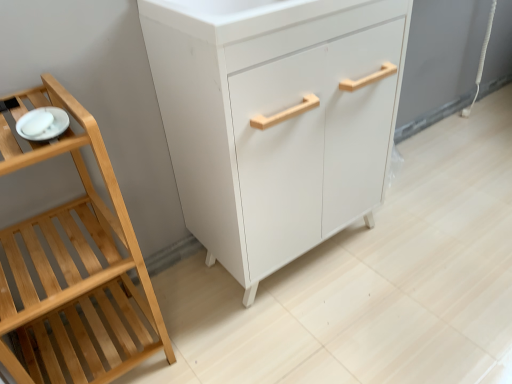
Question: Can you confirm if white glossy plate at left is shorter than natural wood shelf at left?

Choices:
 (A) no
 (B) yes

Answer: (B)

Question: Are white glossy plate at left and natural wood shelf at left far apart?

Choices:
 (A) no
 (B) yes

Answer: (A)

Question: Is white glossy plate at left positioned behind natural wood shelf at left?

Choices:
 (A) yes
 (B) no

Answer: (A)

Question: Can you confirm if white glossy plate at left is thinner than natural wood shelf at left?

Choices:
 (A) yes
 (B) no

Answer: (A)

Question: Can you confirm if white glossy plate at left is wider than natural wood shelf at left?

Choices:
 (A) yes
 (B) no

Answer: (B)

Question: Does point pos(289,200) appear closer or farther from the camera than point pos(101,248)?

Choices:
 (A) farther
 (B) closer

Answer: (A)

Question: Considering the positions of white matte cabinet at center and natural wood shelf at left in the image, is white matte cabinet at center wider or thinner than natural wood shelf at left?

Choices:
 (A) wide
 (B) thin

Answer: (A)

Question: From the image's perspective, relative to natural wood shelf at left, is white matte cabinet at center above or below?

Choices:
 (A) below
 (B) above

Answer: (B)

Question: Based on their positions, is white matte cabinet at center located to the left or right of natural wood shelf at left?

Choices:
 (A) left
 (B) right

Answer: (B)

Question: Is white glossy plate at left in front of or behind natural wood shelf at left in the image?

Choices:
 (A) front
 (B) behind

Answer: (B)

Question: From the image's perspective, is white glossy plate at left located above or below natural wood shelf at left?

Choices:
 (A) below
 (B) above

Answer: (B)

Question: Considering the positions of point (44, 109) and point (10, 321), is point (44, 109) closer or farther from the camera than point (10, 321)?

Choices:
 (A) farther
 (B) closer

Answer: (B)

Question: Is white glossy plate at left inside or outside of natural wood shelf at left?

Choices:
 (A) inside
 (B) outside

Answer: (A)

Question: Does point (59, 119) appear closer or farther from the camera than point (269, 125)?

Choices:
 (A) closer
 (B) farther

Answer: (A)

Question: In the image, is white glossy plate at left positioned in front of or behind white matte cabinet at center?

Choices:
 (A) behind
 (B) front

Answer: (B)